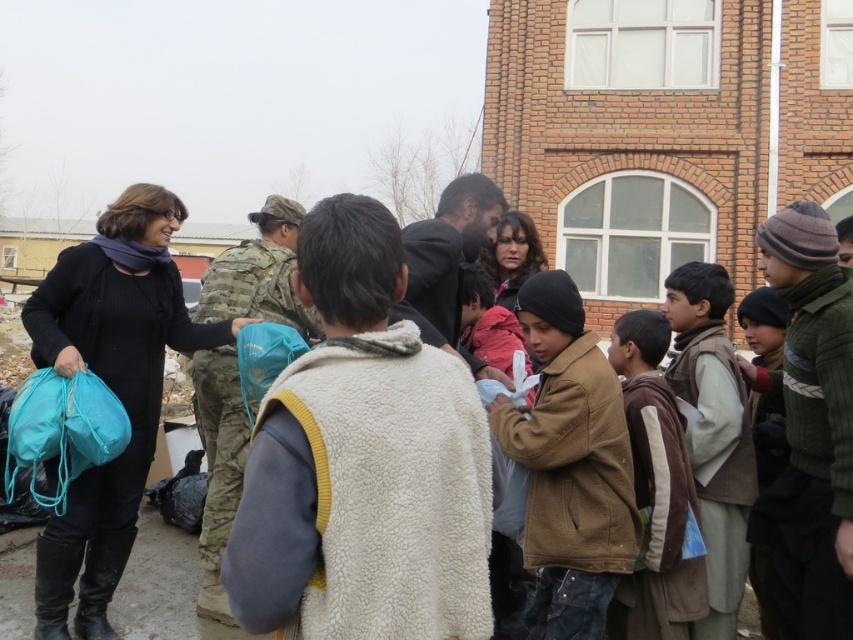
Question: Estimate the real-world distances between objects in this image. Which object is farther from the knitted woolen hat at right?

Choices:
 (A) teal fabric backpack at center
 (B) matte blue fabric bag at lower left
 (C) white fuzzy vest at center

Answer: (B)

Question: Is matte black jacket at left closer to the viewer compared to brown woolen sweater at center-right?

Choices:
 (A) no
 (B) yes

Answer: (B)

Question: Observing the image, what is the correct spatial positioning of brown woolen vest at right in reference to camouflage fabric uniform at center?

Choices:
 (A) above
 (B) below

Answer: (B)

Question: Which object is farther from the camera taking this photo?

Choices:
 (A) matte blue fabric bag at lower left
 (B) white fuzzy vest at center

Answer: (A)

Question: Which of the following is the farthest from the observer?

Choices:
 (A) brown suede jacket at center
 (B) teal fabric backpack at center
 (C) matte blue fabric bag at lower left
 (D) matte black jacket at left

Answer: (B)

Question: Is white fuzzy vest at center thinner than matte black jacket at left?

Choices:
 (A) yes
 (B) no

Answer: (A)